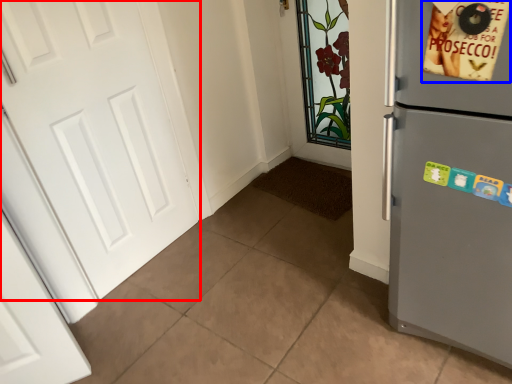
Question: Which of the following is the farthest to the observer, door (highlighted by a red box) or postcard (highlighted by a blue box)?

Choices:
 (A) door
 (B) postcard

Answer: (A)